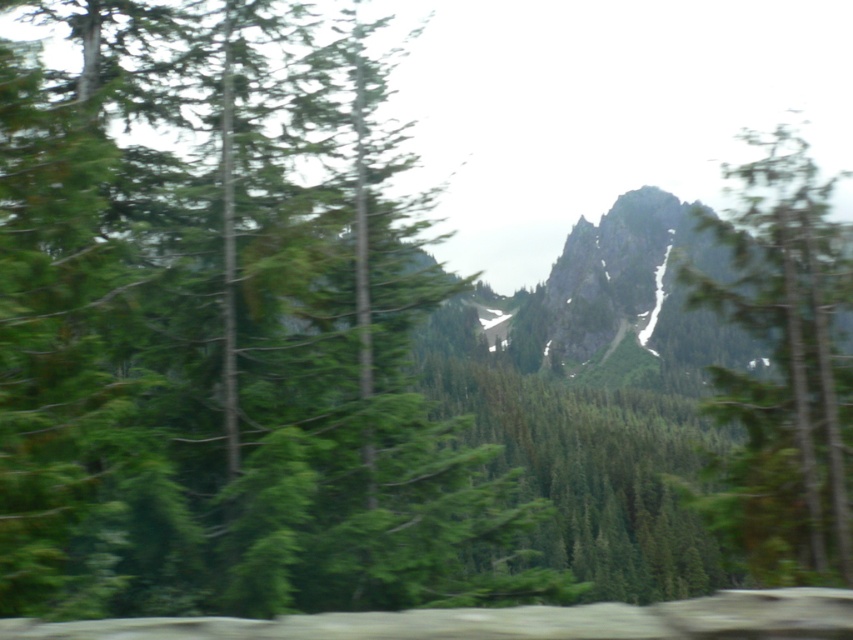
You are a hiker planning to take a photo of both the green matte tree at center and the green textured tree at right from a viewpoint. Which tree should you focus on first if you want to capture both in the same frame without moving your camera?

The green matte tree at center is located above the green textured tree at right, so you should focus on the green textured tree at right first to ensure both are in the frame.

You are standing at the point marked as point (x=225, y=332) in the image. What object is directly in front of you?

The point (x=225, y=332) corresponds to the green matte tree at center, so the green matte tree at center is directly in front of you.